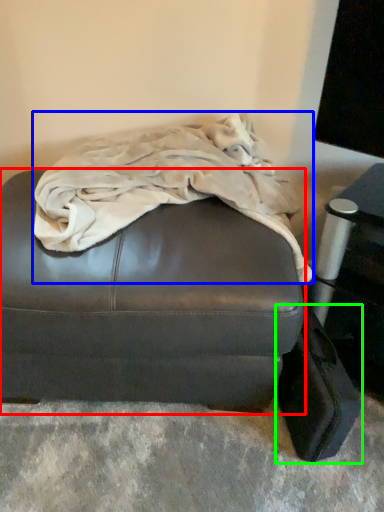
Question: Considering the real-world distances, which object is farthest from furniture (highlighted by a red box)? blanket (highlighted by a blue box) or luggage (highlighted by a green box)?

Choices:
 (A) blanket
 (B) luggage

Answer: (B)